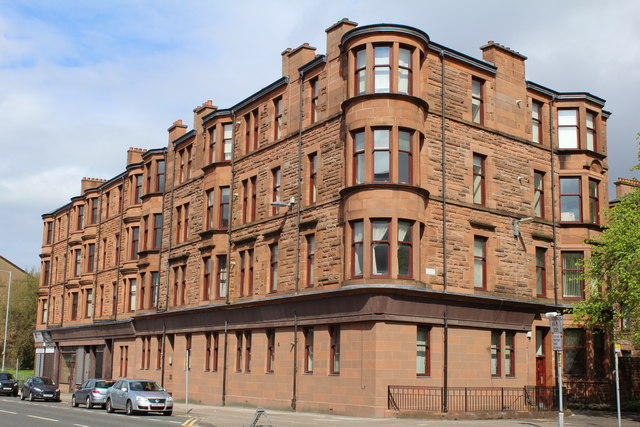
The height and width of the screenshot is (427, 640). I want to click on hood, so click(155, 394), click(49, 386), click(8, 383).